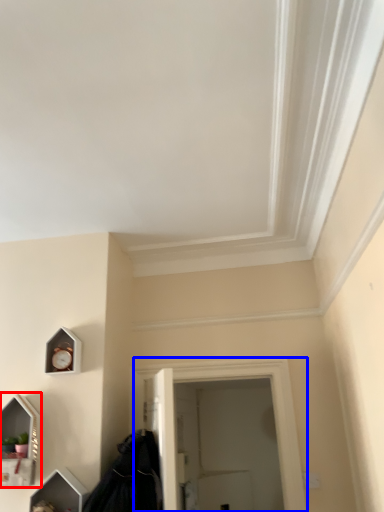
Question: Which point is further to the camera, medicine cabinet (highlighted by a red box) or window (highlighted by a blue box)?

Choices:
 (A) medicine cabinet
 (B) window

Answer: (B)